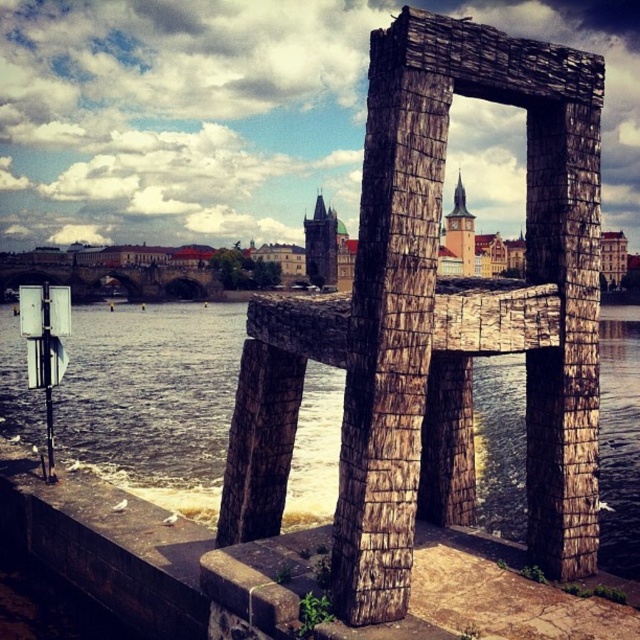
You are a tourist standing on the Charles Bridge in Prague, looking across the Vltava River. You see the wooden chair at center and the brown stone water at center in the distance. Which object is positioned lower from your viewpoint?

The wooden chair at center is positioned lower than the brown stone water at center from your viewpoint.

You are a tourist standing in front of the wooden chair at center and the brown stone water at center. You want to take a photo of the Charles Bridge on the left side of the frame. Which object should you move towards to get a better view of the Charles Bridge?

The wooden chair at center is positioned on the left side of brown stone water at center. To get a better view of the Charles Bridge on the left, you should move towards the wooden chair at center since it is closer to the Charles Bridge side.

You are an architect designing a new public space and want to place a bench in the center. The bench must be wider than the existing wooden chair at center. Can you confirm if the brown stone water at center is wide enough to accommodate the bench?

The wooden chair at center has a lesser width compared to brown stone water at center, so yes, the brown stone water at center is wide enough to accommodate the bench.